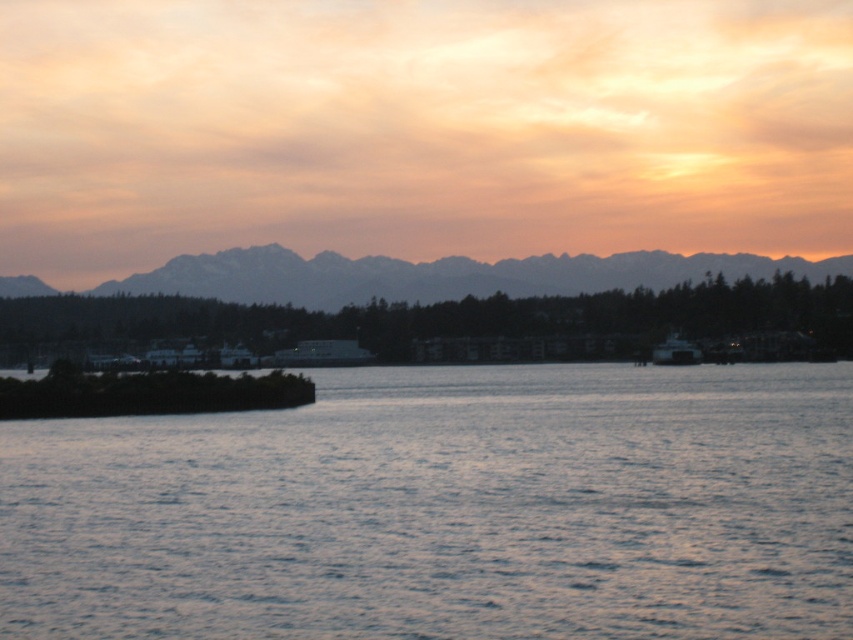
Does blue water at center have a greater height compared to metallic gray boat at right?

No.

The width and height of the screenshot is (853, 640). What do you see at coordinates (445, 509) in the screenshot?
I see `blue water at center` at bounding box center [445, 509].

Find the location of a particular element. This screenshot has width=853, height=640. blue water at center is located at coordinates (445, 509).

Does distant gray mountains at upper center come in front of metallic gray boat at right?

No, distant gray mountains at upper center is further to the viewer.

Does distant gray mountains at upper center appear on the right side of metallic gray boat at right?

No, distant gray mountains at upper center is not to the right of metallic gray boat at right.

Describe the element at coordinates (440, 275) in the screenshot. The height and width of the screenshot is (640, 853). I see `distant gray mountains at upper center` at that location.

At what (x,y) coordinates should I click in order to perform the action: click on distant gray mountains at upper center. Please return your answer as a coordinate pair (x, y). The height and width of the screenshot is (640, 853). Looking at the image, I should click on [440, 275].

Is blue water at center behind distant gray mountains at upper center?

No, it is in front of distant gray mountains at upper center.

Is blue water at center to the left of distant gray mountains at upper center from the viewer's perspective?

No, blue water at center is not to the left of distant gray mountains at upper center.

What do you see at coordinates (445, 509) in the screenshot? I see `blue water at center` at bounding box center [445, 509].

At what (x,y) coordinates should I click in order to perform the action: click on blue water at center. Please return your answer as a coordinate pair (x, y). The width and height of the screenshot is (853, 640). Looking at the image, I should click on (445, 509).